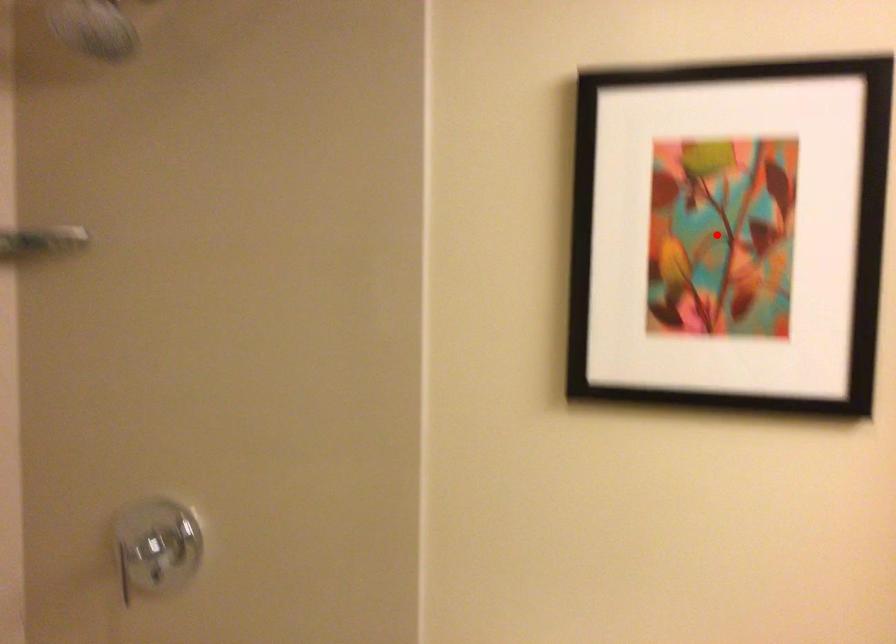
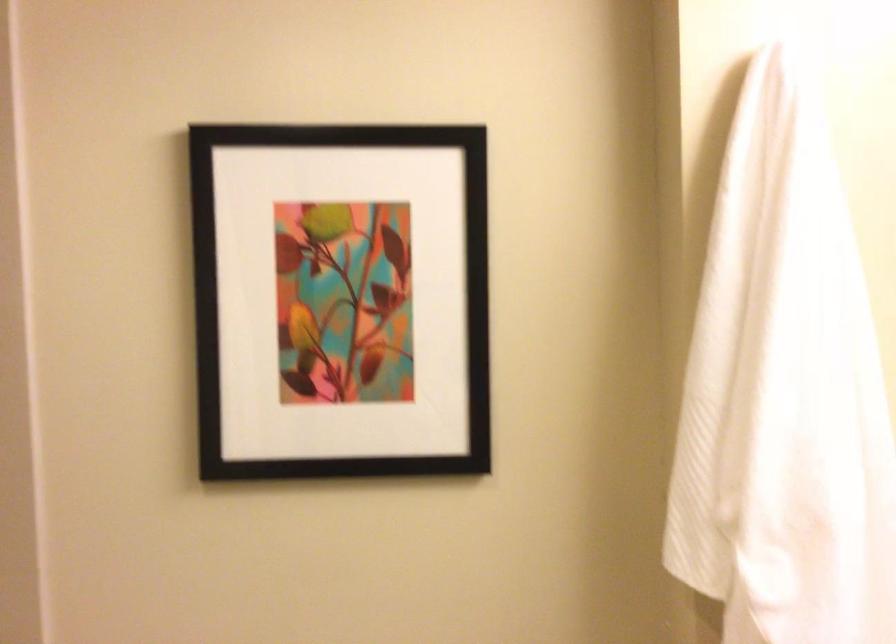
Locate, in the second image, the point that corresponds to the highlighted location in the first image.

(340, 299)